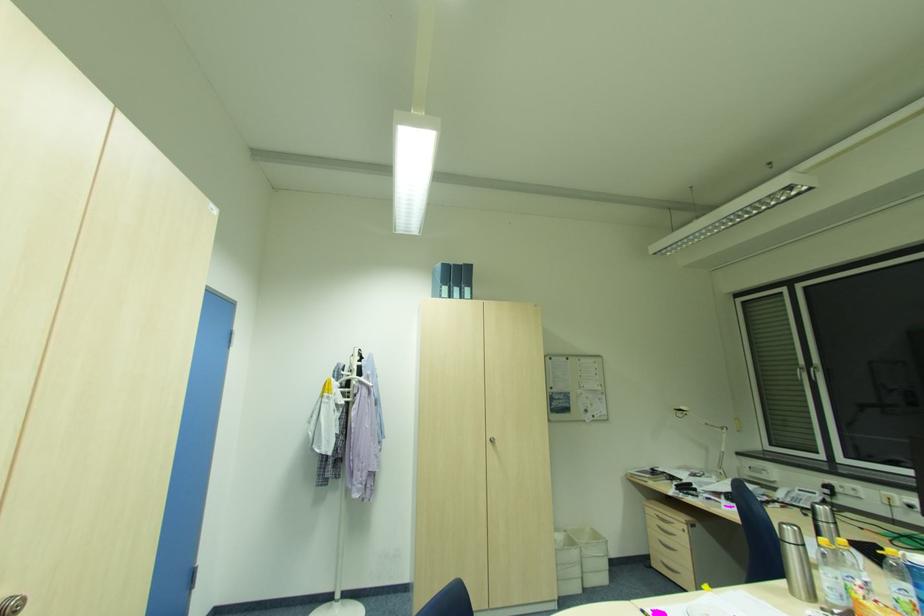
Find where to pull the silver cabinet handle. Please return your answer as a coordinate pair (x, y).

(492, 442)